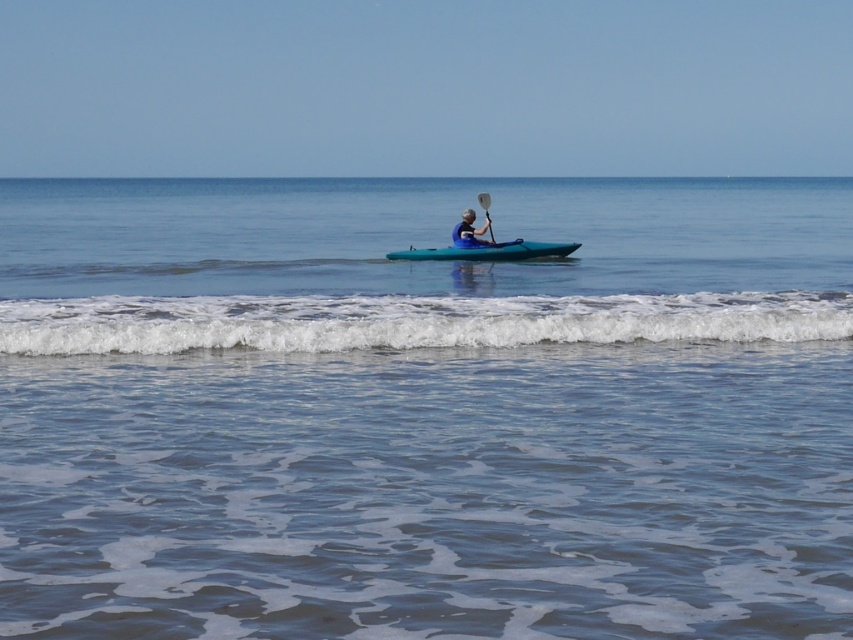
Does clear blue water at center have a greater width compared to white foamy wave at lower center?

Indeed, clear blue water at center has a greater width compared to white foamy wave at lower center.

Between clear blue water at center and white foamy wave at lower center, which one is positioned higher?

Positioned higher is clear blue water at center.

Between point (437, 378) and point (706, 300), which one is positioned in front?

Point (437, 378) is more forward.

Find the location of a particular element. The image size is (853, 640). clear blue water at center is located at coordinates (424, 410).

Is clear blue water at center positioned at the back of teal glossy canoe at center?

No.

Is point (194, 285) less distant than point (440, 248)?

Yes, it is in front of point (440, 248).

You are a GUI agent. You are given a task and a screenshot of the screen. Output one action in this format:
    pyautogui.click(x=<x>, y=<y>)
    Task: Click on the clear blue water at center
    
    Given the screenshot: What is the action you would take?
    pyautogui.click(x=424, y=410)

Does teal glossy canoe at center appear on the right side of white plastic paddle at center?

No, teal glossy canoe at center is not to the right of white plastic paddle at center.

Is point (538, 244) more distant than point (482, 204)?

That is False.

Locate an element on the screen. teal glossy canoe at center is located at coordinates (488, 252).